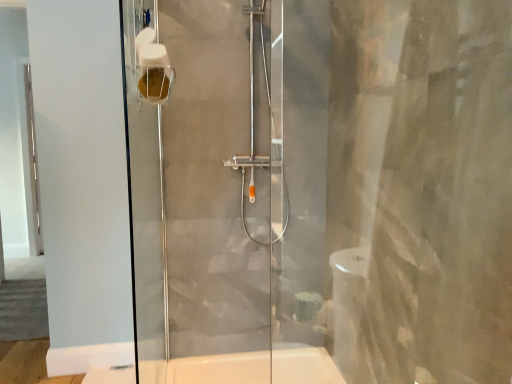
This screenshot has width=512, height=384. What do you see at coordinates (153, 68) in the screenshot? I see `white matte toilet paper at upper left` at bounding box center [153, 68].

The width and height of the screenshot is (512, 384). Find the location of `white matte toilet paper at upper left`. white matte toilet paper at upper left is located at coordinates (153, 68).

Describe the element at coordinates (253, 134) in the screenshot. I see `satin chrome shower at center` at that location.

You are a GUI agent. You are given a task and a screenshot of the screen. Output one action in this format:
    pyautogui.click(x=<x>, y=<y>)
    Task: Click on the satin chrome shower at center
    
    Given the screenshot: What is the action you would take?
    pyautogui.click(x=253, y=134)

Locate an element on the screen. The width and height of the screenshot is (512, 384). white matte toilet paper at upper left is located at coordinates coord(153,68).

Considering the relative positions of satin chrome shower at center and white matte toilet paper at upper left in the image provided, is satin chrome shower at center to the left of white matte toilet paper at upper left from the viewer's perspective?

In fact, satin chrome shower at center is to the right of white matte toilet paper at upper left.

Which object is closer to the camera, satin chrome shower at center or white matte toilet paper at upper left?

white matte toilet paper at upper left is more forward.

Is point (274, 240) positioned after point (156, 98)?

Yes, it is behind point (156, 98).

From the image's perspective, which is below, satin chrome shower at center or white matte toilet paper at upper left?

satin chrome shower at center appears lower in the image.

From a real-world perspective, is satin chrome shower at center located higher than white matte toilet paper at upper left?

No, from a real-world perspective, satin chrome shower at center is not over white matte toilet paper at upper left

Does satin chrome shower at center have a greater width compared to white matte toilet paper at upper left?

Indeed, satin chrome shower at center has a greater width compared to white matte toilet paper at upper left.

From the picture: Can you confirm if satin chrome shower at center is taller than white matte toilet paper at upper left?

Yes.

Can you confirm if satin chrome shower at center is smaller than white matte toilet paper at upper left?

No, satin chrome shower at center is not smaller than white matte toilet paper at upper left.

Can we say satin chrome shower at center lies outside white matte toilet paper at upper left?

Yes, satin chrome shower at center is located beyond the bounds of white matte toilet paper at upper left.

Is satin chrome shower at center far away from white matte toilet paper at upper left?

satin chrome shower at center is far away from white matte toilet paper at upper left.

Could you tell me if satin chrome shower at center is facing white matte toilet paper at upper left?

No, satin chrome shower at center is not oriented towards white matte toilet paper at upper left.

How different are the orientations of satin chrome shower at center and white matte toilet paper at upper left in degrees?

The angle between the facing direction of satin chrome shower at center and the facing direction of white matte toilet paper at upper left is 87 degrees.

Locate an element on the screen. shower on the right of white matte toilet paper at upper left is located at coordinates (253, 134).

Considering the relative positions of white matte toilet paper at upper left and satin chrome shower at center in the image provided, is white matte toilet paper at upper left to the right of satin chrome shower at center from the viewer's perspective?

No.

Is white matte toilet paper at upper left further to camera compared to satin chrome shower at center?

No.

Which is less distant, (x=149, y=93) or (x=238, y=158)?

Point (x=149, y=93) is positioned closer to the camera compared to point (x=238, y=158).

From the image's perspective, between white matte toilet paper at upper left and satin chrome shower at center, who is located below?

From the image's view, satin chrome shower at center is below.

From a real-world perspective, is white matte toilet paper at upper left above or below satin chrome shower at center?

From a real-world perspective, white matte toilet paper at upper left is physically above satin chrome shower at center.

Between white matte toilet paper at upper left and satin chrome shower at center, which one has larger width?

satin chrome shower at center.

Is white matte toilet paper at upper left shorter than satin chrome shower at center?

Indeed, white matte toilet paper at upper left has a lesser height compared to satin chrome shower at center.

Considering the sizes of objects white matte toilet paper at upper left and satin chrome shower at center in the image provided, who is bigger, white matte toilet paper at upper left or satin chrome shower at center?

satin chrome shower at center.

Can we say white matte toilet paper at upper left lies outside satin chrome shower at center?

That's correct, white matte toilet paper at upper left is outside of satin chrome shower at center.

Is white matte toilet paper at upper left touching satin chrome shower at center?

white matte toilet paper at upper left is not next to satin chrome shower at center, and they're not touching.

Is white matte toilet paper at upper left looking in the opposite direction of satin chrome shower at center?

white matte toilet paper at upper left is not turned away from satin chrome shower at center.

How different are the orientations of white matte toilet paper at upper left and satin chrome shower at center in degrees?

The angle between the facing direction of white matte toilet paper at upper left and the facing direction of satin chrome shower at center is 87 degrees.

Measure the distance from white matte toilet paper at upper left to satin chrome shower at center.

A distance of 1.04 meters exists between white matte toilet paper at upper left and satin chrome shower at center.

Find the location of a particular element. toilet paper that appears above the satin chrome shower at center (from the image's perspective) is located at coordinates (153, 68).

Where is `toilet paper that is in front of the satin chrome shower at center`? The image size is (512, 384). toilet paper that is in front of the satin chrome shower at center is located at coordinates (153, 68).

You are a GUI agent. You are given a task and a screenshot of the screen. Output one action in this format:
    pyautogui.click(x=<x>, y=<y>)
    Task: Click on the shower directly beneath the white matte toilet paper at upper left (from a real-world perspective)
    The height and width of the screenshot is (384, 512).
    Given the screenshot: What is the action you would take?
    pyautogui.click(x=253, y=134)